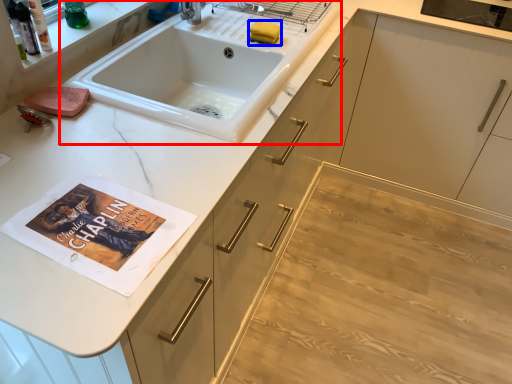
Question: Which object appears closest to the camera in this image, sink (highlighted by a red box) or soap (highlighted by a blue box)?

Choices:
 (A) sink
 (B) soap

Answer: (A)